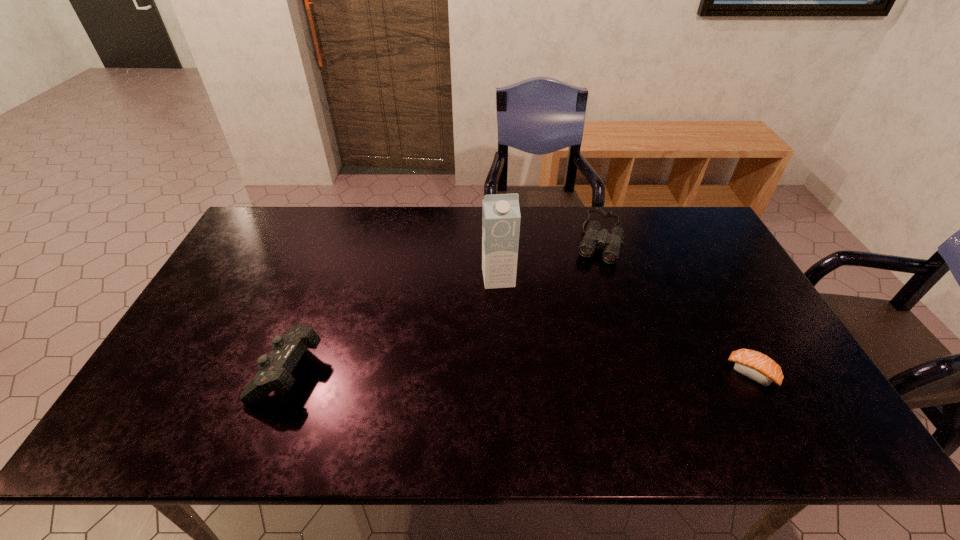
You are a GUI agent. You are given a task and a screenshot of the screen. Output one action in this format:
    pyautogui.click(x=<x>, y=<y>)
    Task: Click on the unoccupied area between the second tallest object and the farthest object
    This screenshot has width=960, height=540.
    Given the screenshot: What is the action you would take?
    pyautogui.click(x=444, y=302)

Image resolution: width=960 pixels, height=540 pixels. I want to click on free space between the third nearest object and the shortest object, so click(x=625, y=326).

Where is `free space between the second farthest object and the binoculars`? This screenshot has height=540, width=960. free space between the second farthest object and the binoculars is located at coordinates (548, 257).

In order to click on unoccupied area between the farthest object and the carton in this screenshot , I will do `click(548, 257)`.

The height and width of the screenshot is (540, 960). Identify the location of vacant space in between the third object from right to left and the rightmost object. (625, 326).

Locate an element on the screen. free spot between the second tallest object and the second object from right to left is located at coordinates (444, 302).

The height and width of the screenshot is (540, 960). I want to click on object that is the third closest to the tallest object, so click(x=752, y=364).

Identify which object is located as the nearest to the third nearest object. Please provide its 2D coordinates. Your answer should be formatted as a tuple, i.e. [(x, y)], where the tuple contains the x and y coordinates of a point satisfying the conditions above.

[(593, 236)]

At what (x,y) coordinates should I click in order to perform the action: click on vacant space that satisfies the following two spatial constraints: 1. on the back side of the third object from left to right; 2. on the right side of the control. Please return your answer as a coordinate pair (x, y). The height and width of the screenshot is (540, 960). Looking at the image, I should click on (340, 236).